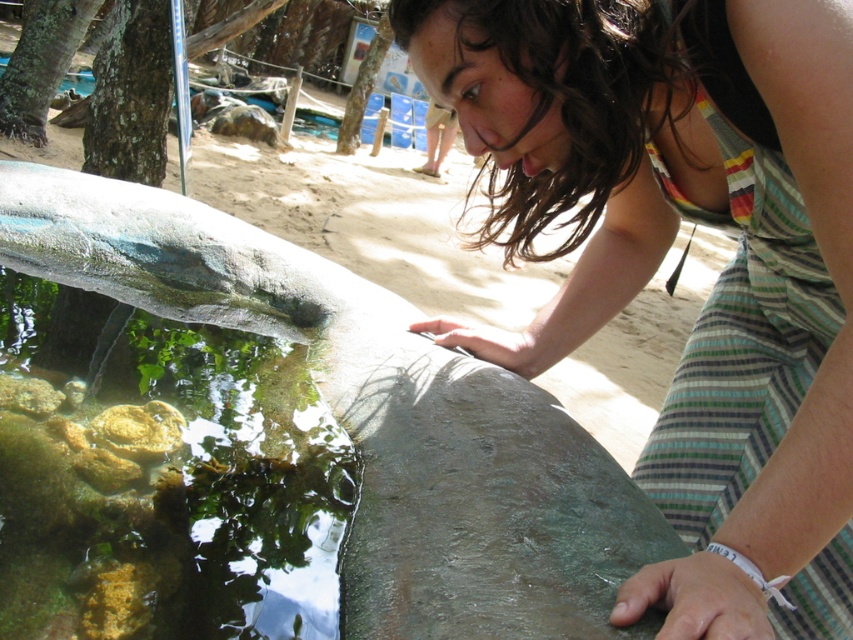
You are standing in the garden and want to take a photo of the striped fabric dress at center and the clear glass fish pond at lower left. Which object should you focus on first if you want both to be in sharp focus?

The striped fabric dress at center is closer to the viewer than the clear glass fish pond at lower left. To ensure both are in sharp focus, focus on the striped fabric dress at center first since it is closer, and the pond will be in focus as it is further away within the depth of field.

You are standing at the edge of the clear glass fish pond at lower left and want to reach the striped fabric dress at center. In which direction should you move to get closer to the dress?

You should move to the right to get closer to the striped fabric dress at center since it is located to the right of the clear glass fish pond at lower left.

You are designing a costume for a play where the character needs to move freely. The costume includes the striped fabric dress at center and the smooth stone fish at center. Which item might hinder movement more due to its size?

The smooth stone fish at center might hinder movement more because it is thicker than the striped fabric dress at center.